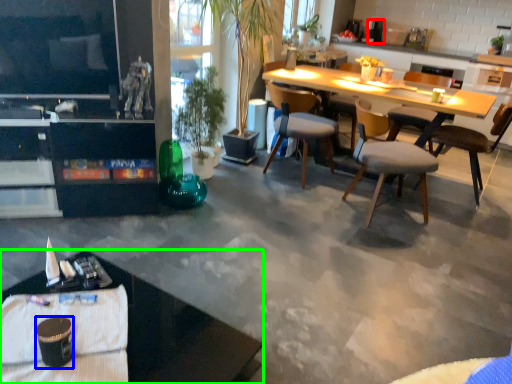
Question: Which object is positioned closest to coffee maker (highlighted by a red box)? Select from coffee cup (highlighted by a blue box) and desk (highlighted by a green box).

Choices:
 (A) coffee cup
 (B) desk

Answer: (B)